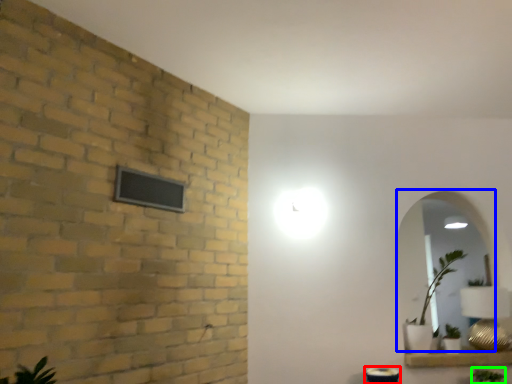
Question: Estimate the real-world distances between objects in this image. Which object is closer to table (highlighted by a red box), mirror (highlighted by a blue box) or plant (highlighted by a green box)?

Choices:
 (A) mirror
 (B) plant

Answer: (B)